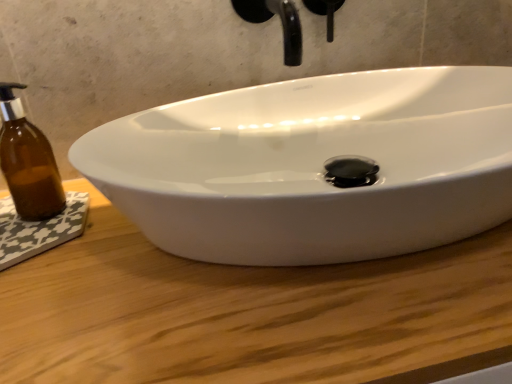
The width and height of the screenshot is (512, 384). In order to click on free space to the right of brown glass bottle at left in this screenshot , I will do `click(122, 231)`.